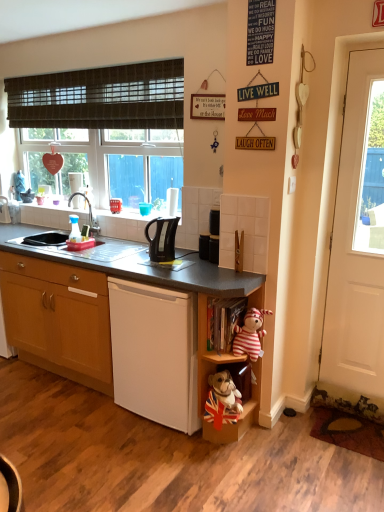
Find the location of a particular element. The image size is (384, 512). empty space that is ontop of wooden bookshelf at lower center, acting as the second shelf starting from the top is located at coordinates (236, 280).